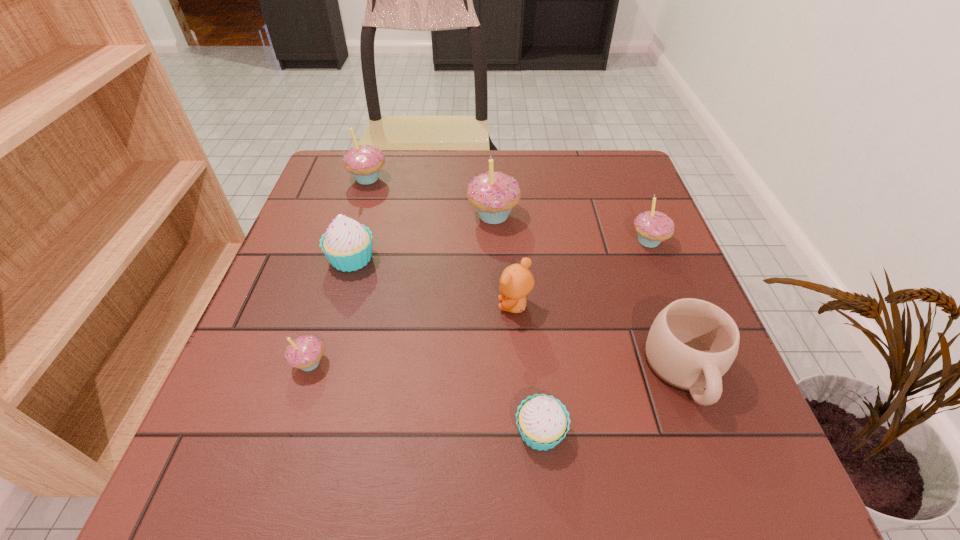
This screenshot has height=540, width=960. I want to click on the tallest object, so click(493, 194).

This screenshot has height=540, width=960. I want to click on the second pink cupcake from right to left, so click(493, 194).

This screenshot has width=960, height=540. Identify the location of the farthest cupcake. (364, 162).

Locate an element on the screen. The height and width of the screenshot is (540, 960). the farthest pink cupcake is located at coordinates (364, 162).

Where is `the rightmost pink cupcake`? Image resolution: width=960 pixels, height=540 pixels. the rightmost pink cupcake is located at coordinates (653, 227).

Find the location of a particular element. This screenshot has width=960, height=540. the rightmost cupcake is located at coordinates (653, 227).

The height and width of the screenshot is (540, 960). I want to click on the left white cupcake, so click(x=347, y=244).

This screenshot has width=960, height=540. In order to click on the bigger white cupcake in this screenshot , I will do `click(347, 244)`.

You are a GUI agent. You are given a task and a screenshot of the screen. Output one action in this format:
    pyautogui.click(x=<x>, y=<y>)
    Task: Click on the brown teddy bear
    The image size is (960, 540).
    Given the screenshot: What is the action you would take?
    pyautogui.click(x=516, y=281)

The width and height of the screenshot is (960, 540). I want to click on teddy bear, so click(x=516, y=281).